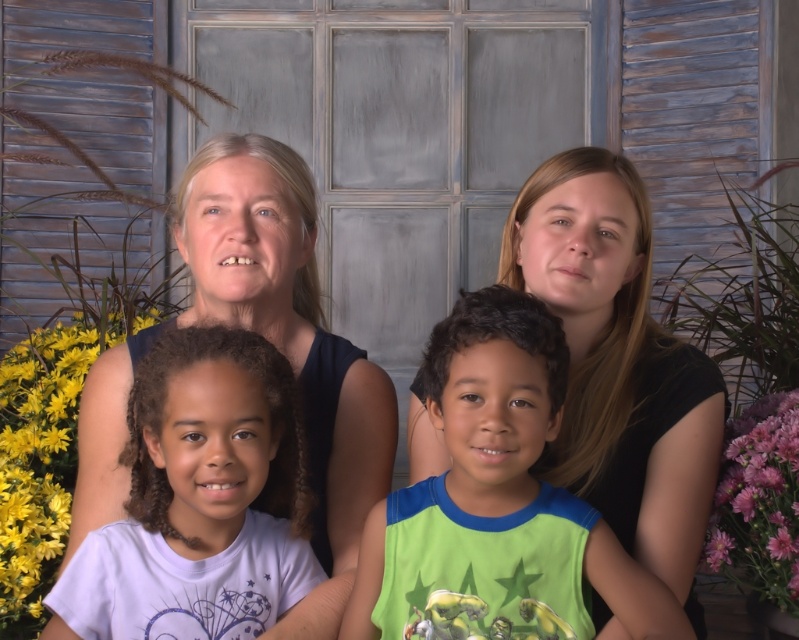
Measure the distance between purple silky flower at right and purple matte flower at lower right.

A distance of 5.03 inches exists between purple silky flower at right and purple matte flower at lower right.

Can you confirm if purple silky flower at right is positioned to the right of purple matte flower at lower right?

Correct, you'll find purple silky flower at right to the right of purple matte flower at lower right.

Does point (710, 557) come in front of point (710, 557)?

Yes, it is in front of point (710, 557).

Image resolution: width=799 pixels, height=640 pixels. Identify the location of purple silky flower at right. (758, 499).

Does green fabric shirt at center have a larger size compared to purple silky flower at right?

Yes, green fabric shirt at center is bigger than purple silky flower at right.

Which is in front, point (456, 307) or point (726, 476)?

Point (456, 307)

Is point (427, 364) farther from viewer compared to point (781, 496)?

That is False.

You are a GUI agent. You are given a task and a screenshot of the screen. Output one action in this format:
    pyautogui.click(x=<x>, y=<y>)
    Task: Click on the green fabric shirt at center
    Image resolution: width=799 pixels, height=640 pixels.
    Given the screenshot: What is the action you would take?
    (499, 483)

Can you confirm if green fabric shirt at center is positioned to the right of yellow matte flower at lower left?

Yes, green fabric shirt at center is to the right of yellow matte flower at lower left.

Which is behind, point (507, 369) or point (36, 563)?

Positioned behind is point (36, 563).

At what (x,y) coordinates should I click in order to perform the action: click on green fabric shirt at center. Please return your answer as a coordinate pair (x, y). Image resolution: width=799 pixels, height=640 pixels. Looking at the image, I should click on (499, 483).